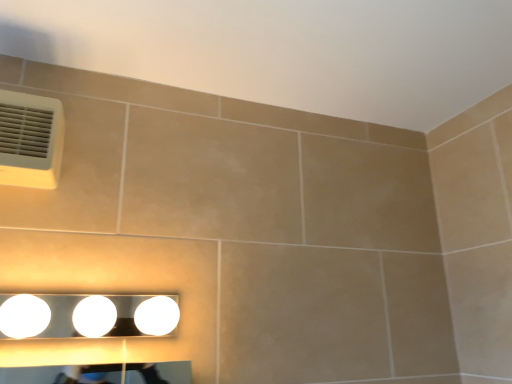
Question: From their relative heights in the image, would you say white glossy light fixture at lower center is taller or shorter than white plastic air conditioning at upper left?

Choices:
 (A) short
 (B) tall

Answer: (A)

Question: From the image's perspective, relative to white plastic air conditioning at upper left, is white glossy light fixture at lower center above or below?

Choices:
 (A) above
 (B) below

Answer: (B)

Question: Considering the positions of point (17, 337) and point (0, 124), is point (17, 337) closer or farther from the camera than point (0, 124)?

Choices:
 (A) farther
 (B) closer

Answer: (B)

Question: Based on their sizes in the image, would you say white plastic air conditioning at upper left is bigger or smaller than white glossy light fixture at lower center?

Choices:
 (A) small
 (B) big

Answer: (A)

Question: Considering their positions, is white plastic air conditioning at upper left located in front of or behind white glossy light fixture at lower center?

Choices:
 (A) behind
 (B) front

Answer: (A)

Question: Considering the positions of white plastic air conditioning at upper left and white glossy light fixture at lower center in the image, is white plastic air conditioning at upper left wider or thinner than white glossy light fixture at lower center?

Choices:
 (A) thin
 (B) wide

Answer: (A)

Question: Would you say white plastic air conditioning at upper left is to the left or to the right of white glossy light fixture at lower center in the picture?

Choices:
 (A) left
 (B) right

Answer: (A)